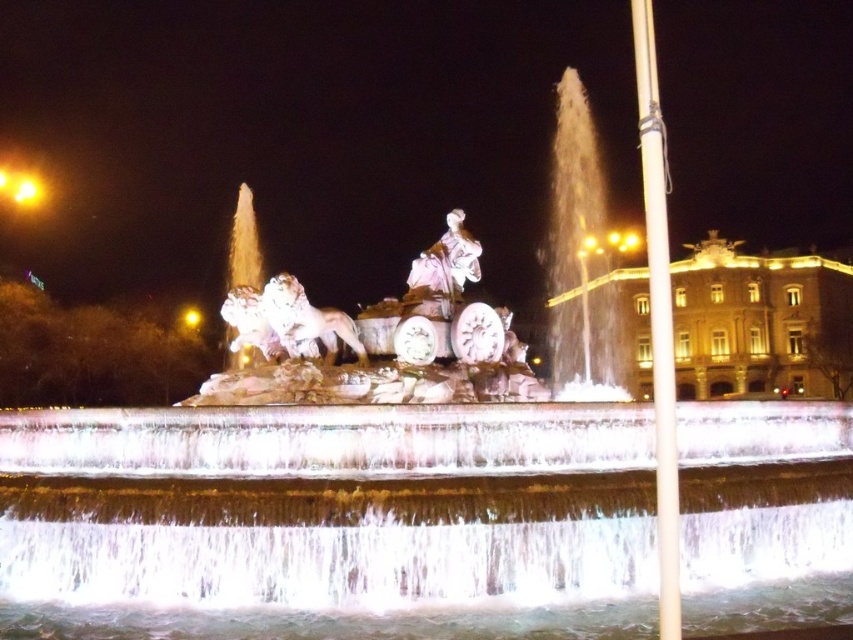
Who is positioned more to the left, golden stone palace at center right or white marble statue at center?

white marble statue at center

Is golden stone palace at center right smaller than white marble statue at center?

Incorrect, golden stone palace at center right is not smaller in size than white marble statue at center.

The image size is (853, 640). What are the coordinates of `golden stone palace at center right` in the screenshot? It's located at (759, 323).

Which is above, clear water at center or golden stone palace at center right?

golden stone palace at center right is higher up.

Does clear water at center come behind golden stone palace at center right?

No, it is not.

From the picture: Who is more distant from viewer, [67,444] or [712,397]?

The point [712,397] is more distant.

Where is `clear water at center`? This screenshot has width=853, height=640. clear water at center is located at coordinates (328, 522).

Does clear water at center have a greater height compared to white marble statue at center?

Yes, clear water at center is taller than white marble statue at center.

In the scene shown: Can you confirm if clear water at center is positioned below white marble statue at center?

Indeed, clear water at center is positioned under white marble statue at center.

Does point (57, 484) come farther from viewer compared to point (456, 253)?

No.

Image resolution: width=853 pixels, height=640 pixels. What are the coordinates of `clear water at center` in the screenshot? It's located at (328, 522).